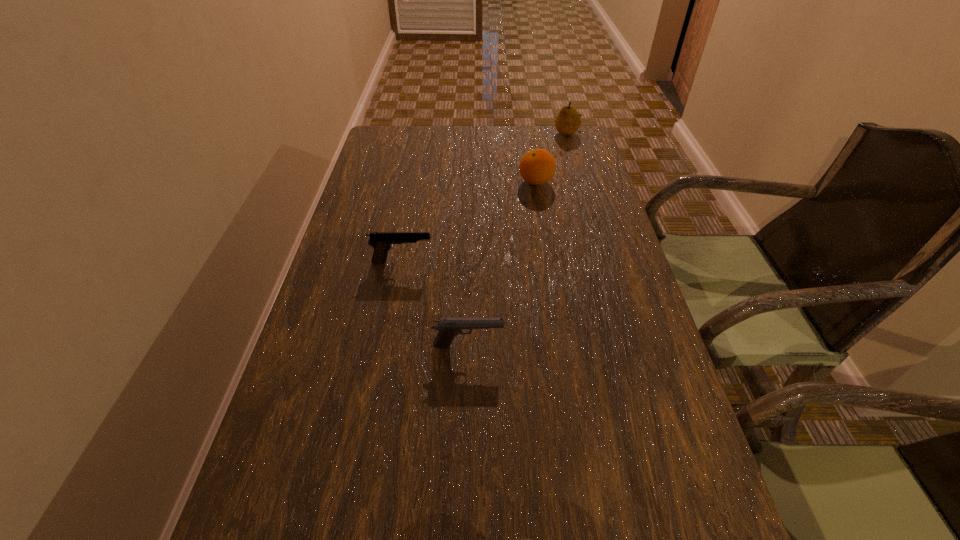
Locate an element on the screen. This screenshot has width=960, height=540. free space between the pear and the leftmost object is located at coordinates (485, 197).

This screenshot has height=540, width=960. What are the coordinates of `unoccupied area between the nearer pistol and the third farthest object` in the screenshot? It's located at (435, 304).

Where is `empty space that is in between the farthest object and the second nearest object`? Image resolution: width=960 pixels, height=540 pixels. empty space that is in between the farthest object and the second nearest object is located at coordinates (517, 239).

Find the location of a particular element. empty space between the farther pistol and the farthest object is located at coordinates (485, 197).

Where is `vacant area that lies between the farther pistol and the rightmost object`? vacant area that lies between the farther pistol and the rightmost object is located at coordinates (485, 197).

Locate an element on the screen. This screenshot has width=960, height=540. vacant space that is in between the fourth farthest object and the rightmost object is located at coordinates (517, 239).

Locate which object ranks fourth in proximity to the farthest object. Please provide its 2D coordinates. Your answer should be formatted as a tuple, i.e. [(x, y)], where the tuple contains the x and y coordinates of a point satisfying the conditions above.

[(513, 539)]

Identify which object is the second nearest to the second farthest object. Please provide its 2D coordinates. Your answer should be formatted as a tuple, i.e. [(x, y)], where the tuple contains the x and y coordinates of a point satisfying the conditions above.

[(382, 242)]

The width and height of the screenshot is (960, 540). I want to click on vacant point that satisfies the following two spatial constraints: 1. on the front side of the orange; 2. at the barrel of the second nearest object, so click(x=563, y=346).

The width and height of the screenshot is (960, 540). I want to click on free point that satisfies the following two spatial constraints: 1. on the front side of the pear; 2. at the muzzle of the left pistol, so tap(606, 261).